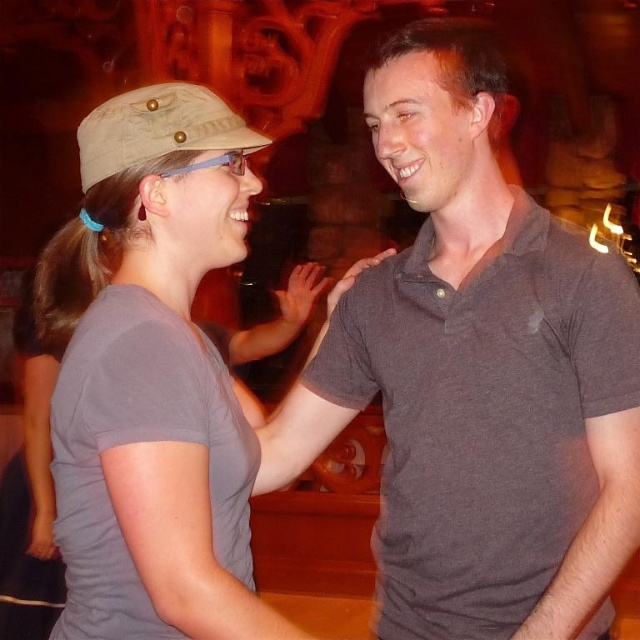
Which of these two, gray cotton polo shirt at center or tan canvas baseball hat at left, stands taller?

Standing taller between the two is gray cotton polo shirt at center.

Does point (330, 388) come in front of point (129, 150)?

No, it is not.

Between point (349, 413) and point (216, 113), which one is positioned behind?

Point (349, 413)

Where is `gray cotton polo shirt at center`? The height and width of the screenshot is (640, 640). gray cotton polo shirt at center is located at coordinates (477, 374).

In the scene shown: Does matte khaki cap at left appear under tan canvas baseball hat at left?

Yes, matte khaki cap at left is below tan canvas baseball hat at left.

In the scene shown: Does matte khaki cap at left appear on the right side of tan canvas baseball hat at left?

No, matte khaki cap at left is not to the right of tan canvas baseball hat at left.

Locate an element on the screen. The height and width of the screenshot is (640, 640). matte khaki cap at left is located at coordinates (152, 378).

Who is higher up, gray cotton polo shirt at center or matte khaki cap at left?

gray cotton polo shirt at center is above.

How much distance is there between gray cotton polo shirt at center and matte khaki cap at left?

They are 62.64 centimeters apart.

Is point (428, 508) positioned before point (61, 362)?

No, (428, 508) is behind (61, 362).

Find the location of a particular element. This screenshot has width=640, height=640. gray cotton polo shirt at center is located at coordinates (477, 374).